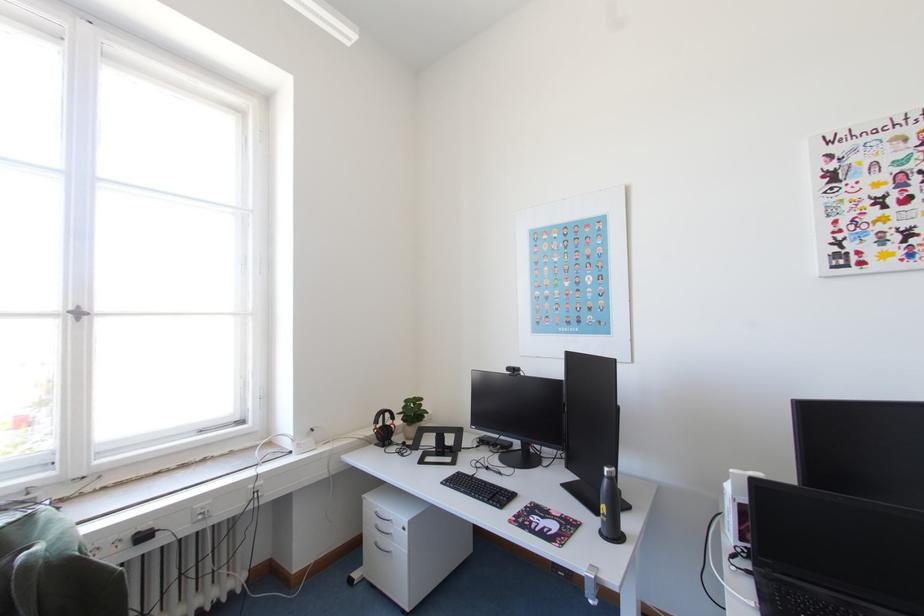
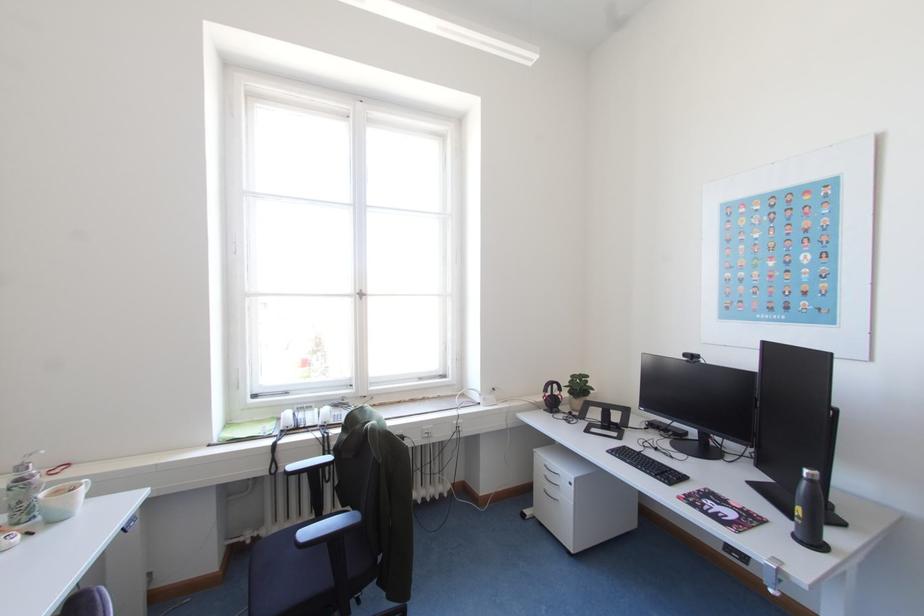
Question: In a continuous first-person perspective shot, in which direction is the camera moving?

Choices:
 (A) Left
 (B) Right
 (C) Forward
 (D) Backward

Answer: (D)